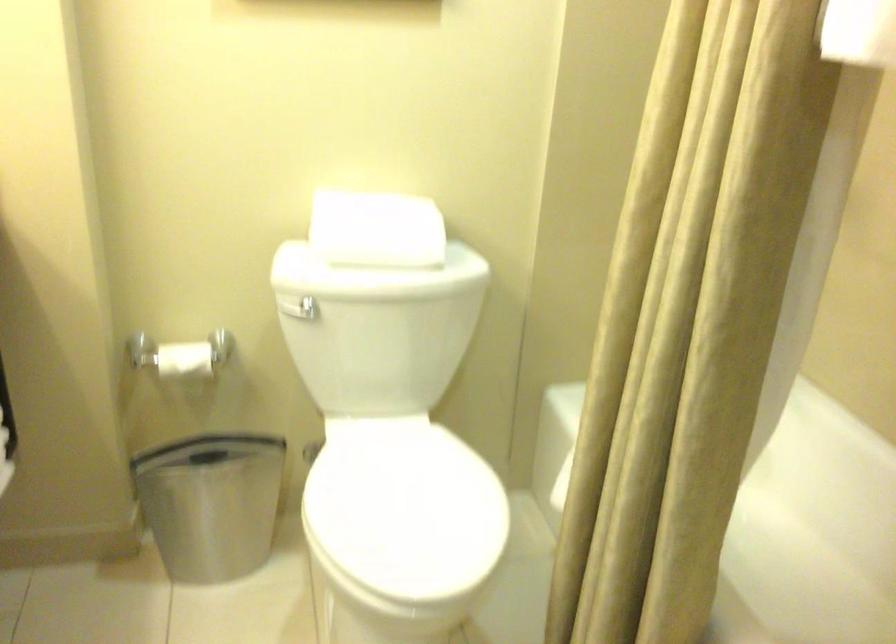
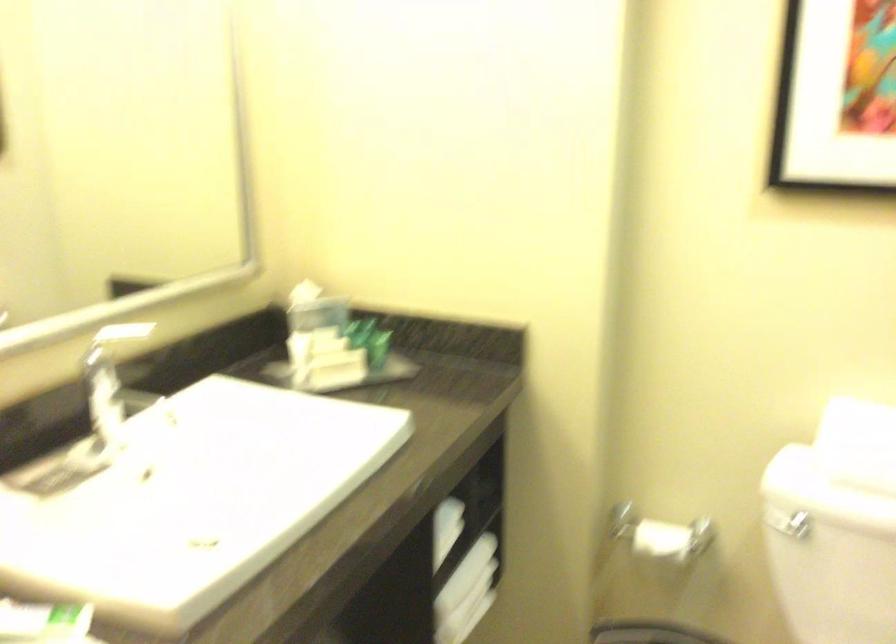
Where in the second image is the point corresponding to [304,310] from the first image?

(788, 524)